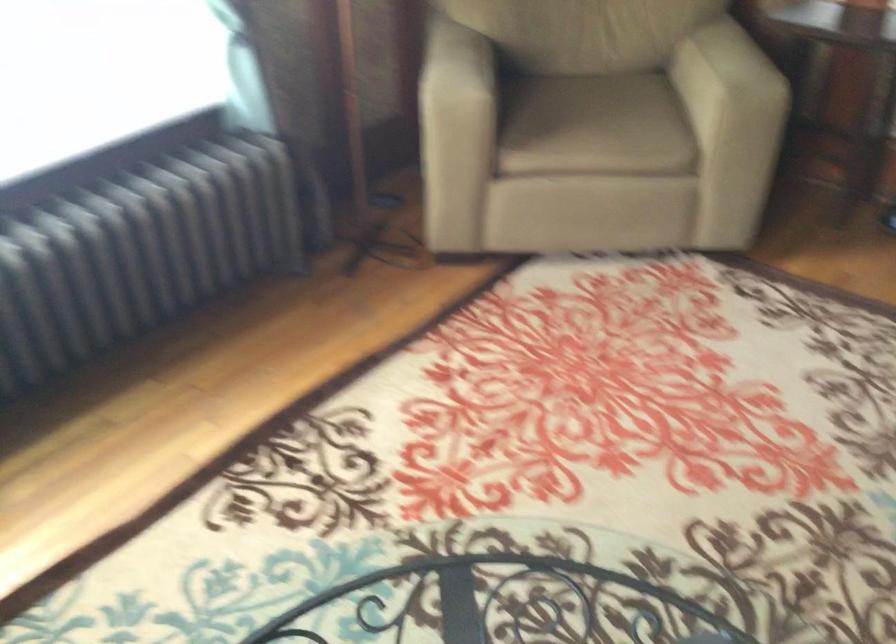
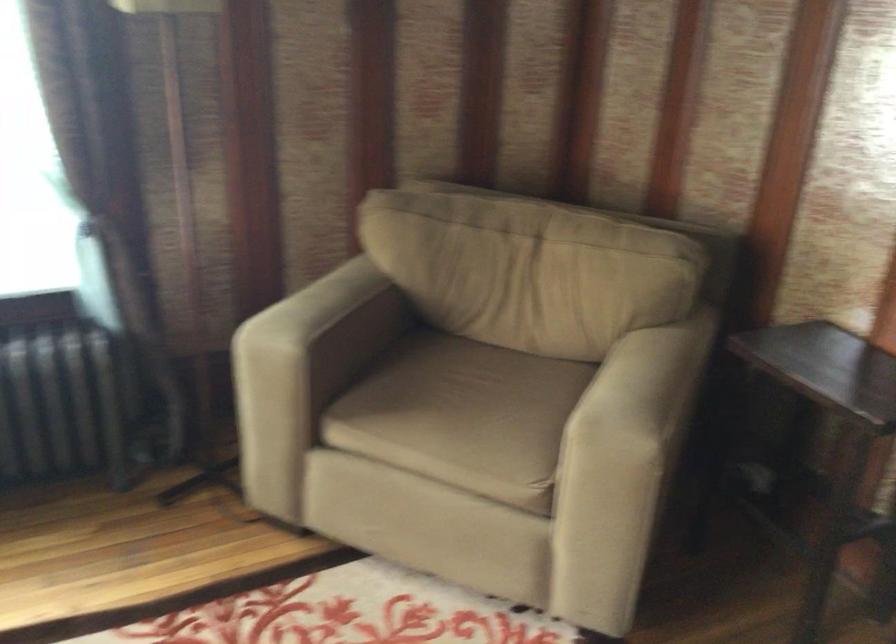
The point at [760,71] is marked in the first image. Where is the corresponding point in the second image?

(640, 413)